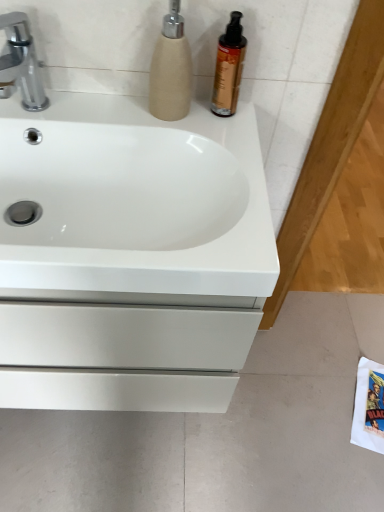
Question: Which direction should I rotate to look at beige textured soap dispenser at upper center?

Choices:
 (A) left
 (B) right

Answer: (A)

Question: Can you confirm if white matte drawer at lower left is thinner than white glossy sink at center?

Choices:
 (A) yes
 (B) no

Answer: (B)

Question: Is white matte drawer at lower left at the right side of white glossy sink at center?

Choices:
 (A) no
 (B) yes

Answer: (B)

Question: Is white matte drawer at lower left positioned far away from white glossy sink at center?

Choices:
 (A) yes
 (B) no

Answer: (B)

Question: Does white matte drawer at lower left have a greater height compared to white glossy sink at center?

Choices:
 (A) no
 (B) yes

Answer: (A)

Question: From the image's perspective, is white matte drawer at lower left located above white glossy sink at center?

Choices:
 (A) no
 (B) yes

Answer: (A)

Question: Can you see white matte drawer at lower left touching white glossy sink at center?

Choices:
 (A) yes
 (B) no

Answer: (B)

Question: From a real-world perspective, is beige textured soap dispenser at upper center beneath shiny amber bottle at upper right?

Choices:
 (A) yes
 (B) no

Answer: (B)

Question: Is shiny amber bottle at upper right a part of beige textured soap dispenser at upper center?

Choices:
 (A) no
 (B) yes

Answer: (A)

Question: Does beige textured soap dispenser at upper center have a greater height compared to shiny amber bottle at upper right?

Choices:
 (A) yes
 (B) no

Answer: (A)

Question: Is beige textured soap dispenser at upper center looking in the opposite direction of shiny amber bottle at upper right?

Choices:
 (A) yes
 (B) no

Answer: (B)

Question: Is beige textured soap dispenser at upper center far away from shiny amber bottle at upper right?

Choices:
 (A) yes
 (B) no

Answer: (B)

Question: Considering the relative sizes of beige textured soap dispenser at upper center and shiny amber bottle at upper right in the image provided, is beige textured soap dispenser at upper center thinner than shiny amber bottle at upper right?

Choices:
 (A) yes
 (B) no

Answer: (B)

Question: Can you confirm if silver metallic faucet at upper left is smaller than beige textured soap dispenser at upper center?

Choices:
 (A) yes
 (B) no

Answer: (B)